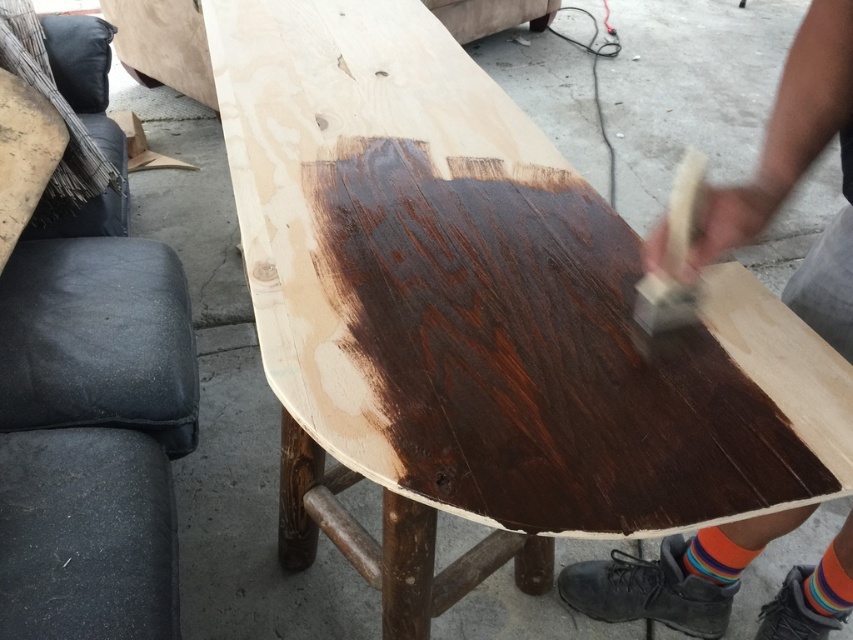
Does wooden textured hammer at right appear over multicolored fabric sock at lower right?

Yes.

Who is positioned more to the left, wooden textured hammer at right or multicolored fabric sock at lower right?

Positioned to the left is multicolored fabric sock at lower right.

Locate an element on the screen. Image resolution: width=853 pixels, height=640 pixels. wooden textured hammer at right is located at coordinates (672, 256).

Measure the distance from black leather stool at lower left to wooden textured hammer at right.

black leather stool at lower left is 2.00 meters away from wooden textured hammer at right.

Is black leather stool at lower left to the right of wooden textured hammer at right from the viewer's perspective?

Incorrect, black leather stool at lower left is not on the right side of wooden textured hammer at right.

Where is `black leather stool at lower left`? black leather stool at lower left is located at coordinates (93, 435).

Does wooden paintbrush at center have a smaller size compared to multicolored fabric sock at lower right?

No, wooden paintbrush at center is not smaller than multicolored fabric sock at lower right.

Is point (772, 628) positioned before point (831, 616)?

No, (772, 628) is behind (831, 616).

Locate an element on the screen. The width and height of the screenshot is (853, 640). wooden paintbrush at center is located at coordinates (799, 172).